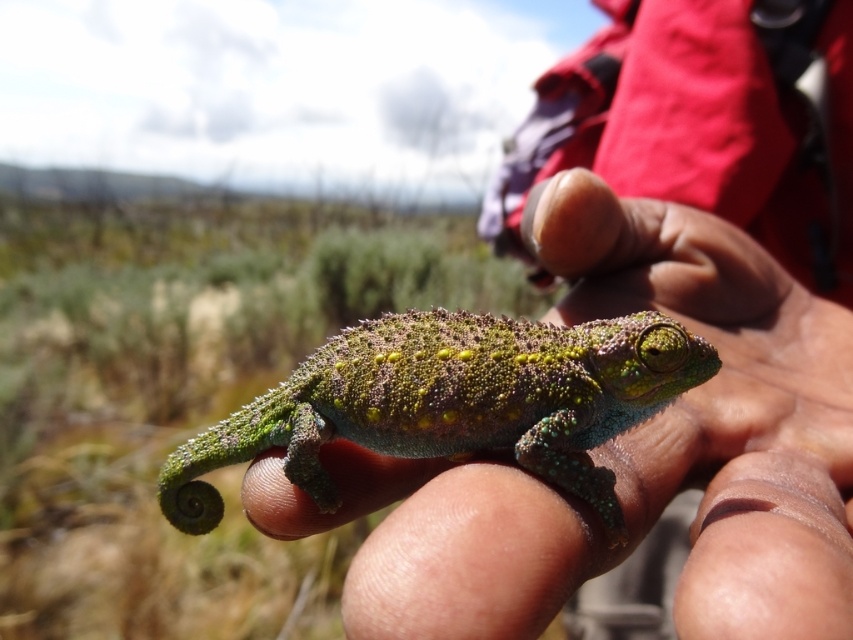
Looking at this image, you are a wildlife photographer trying to capture a clear photo of the green scaly chameleon at center and the green scaly lizard at center. Since both are similar in color, which one would be easier to focus on due to its position?

The green scaly chameleon at center is easier to focus on because it is positioned in front of the green scaly lizard at center, making it more distinct in the image.

You are a biologist observing two reptiles in the image. You need to determine which one is wider. The reptiles are the green scaly chameleon at center and the green scaly lizard at center. Which one has a greater width?

The green scaly chameleon at center might be wider than green scaly lizard at center according to the description.

You are trying to determine the position of two points on the chameleon in the image. The first point is at coordinate point (708, 502) and the second is at point (161, 502). Which point is closer to you?

Point (708, 502) is closer to the viewer than point (161, 502).